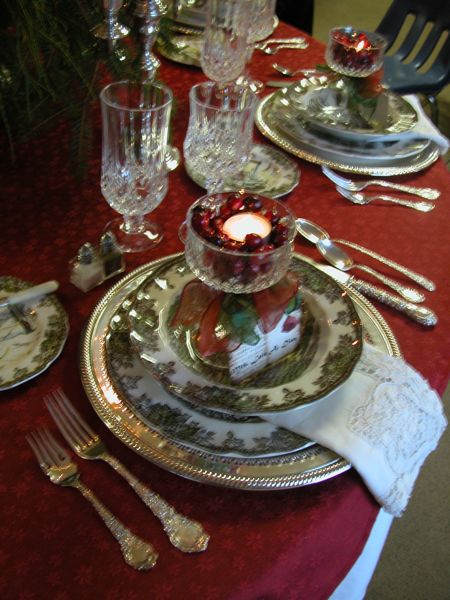
This screenshot has height=600, width=450. In order to click on napkin in this screenshot , I will do `click(349, 439)`, `click(425, 126)`.